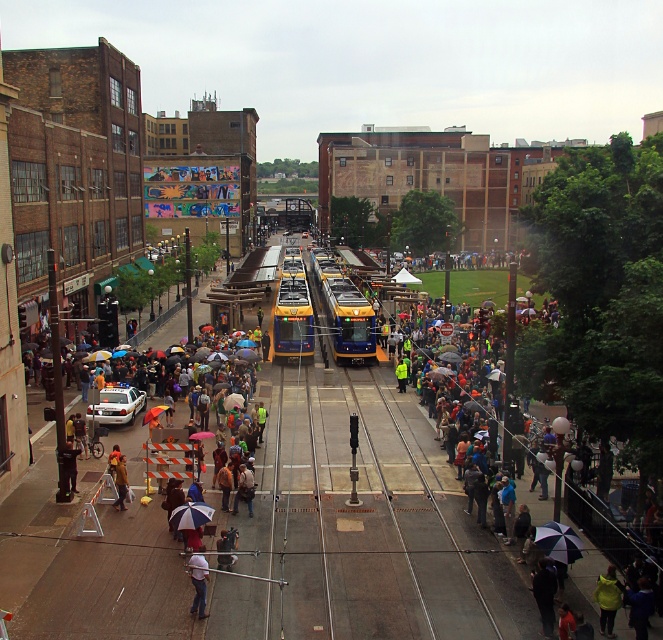
Which is behind, point (196, 564) or point (190, 525)?

Positioned behind is point (190, 525).

Which is above, white matte shirt at lower center or blue fabric umbrella at lower center?

blue fabric umbrella at lower center is higher up.

Who is more distant from viewer, (198, 570) or (176, 518)?

Positioned behind is point (176, 518).

Locate an element on the screen. white matte shirt at lower center is located at coordinates (198, 580).

Does blue fabric umbrella at lower center have a lesser width compared to orange fabric umbrella at center?

Correct, blue fabric umbrella at lower center's width is less than orange fabric umbrella at center's.

Describe the element at coordinates (190, 515) in the screenshot. I see `blue fabric umbrella at lower center` at that location.

Which is in front, point (204, 508) or point (164, 408)?

Point (204, 508) is in front.

Where is `blue fabric umbrella at lower center`? blue fabric umbrella at lower center is located at coordinates (190, 515).

Where is `dark blue fabric umbrella at lower right`? This screenshot has width=663, height=640. dark blue fabric umbrella at lower right is located at coordinates (558, 541).

Is point (552, 525) closer to viewer compared to point (198, 577)?

No, it is behind (198, 577).

Image resolution: width=663 pixels, height=640 pixels. In order to click on dark blue fabric umbrella at lower right in this screenshot , I will do `click(558, 541)`.